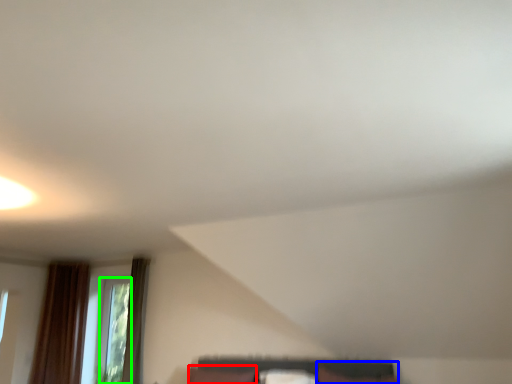
Question: Which object is positioned closest to pillow (highlighted by a red box)? Select from furniture (highlighted by a blue box) and window (highlighted by a green box).

Choices:
 (A) furniture
 (B) window

Answer: (A)